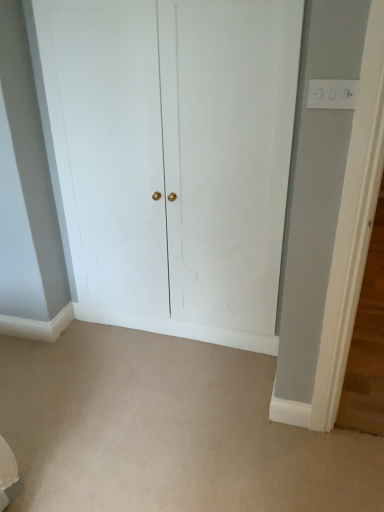
Question: Relative to beige carpet at center, is white matte door at center in front or behind?

Choices:
 (A) front
 (B) behind

Answer: (B)

Question: Looking at the image, does white matte door at center seem bigger or smaller compared to beige carpet at center?

Choices:
 (A) big
 (B) small

Answer: (A)

Question: Considering the positions of white matte door at center and beige carpet at center in the image, is white matte door at center wider or thinner than beige carpet at center?

Choices:
 (A) wide
 (B) thin

Answer: (B)

Question: Is beige carpet at center in front of or behind white matte door at center in the image?

Choices:
 (A) behind
 (B) front

Answer: (B)

Question: Considering the positions of beige carpet at center and white matte door at center in the image, is beige carpet at center taller or shorter than white matte door at center?

Choices:
 (A) short
 (B) tall

Answer: (A)

Question: Is beige carpet at center to the left or to the right of white matte door at center in the image?

Choices:
 (A) left
 (B) right

Answer: (A)

Question: In terms of width, does beige carpet at center look wider or thinner when compared to white matte door at center?

Choices:
 (A) wide
 (B) thin

Answer: (A)